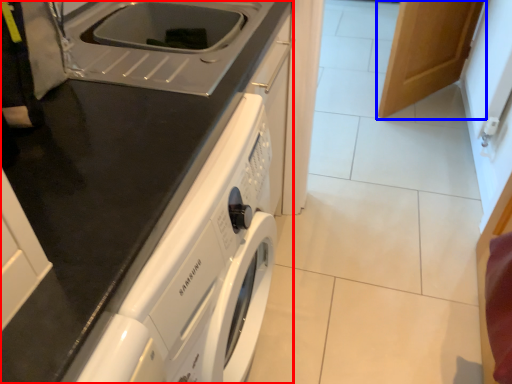
Question: Which of the following is the closest to the observer, home appliance (highlighted by a red box) or cabinetry (highlighted by a blue box)?

Choices:
 (A) home appliance
 (B) cabinetry

Answer: (A)